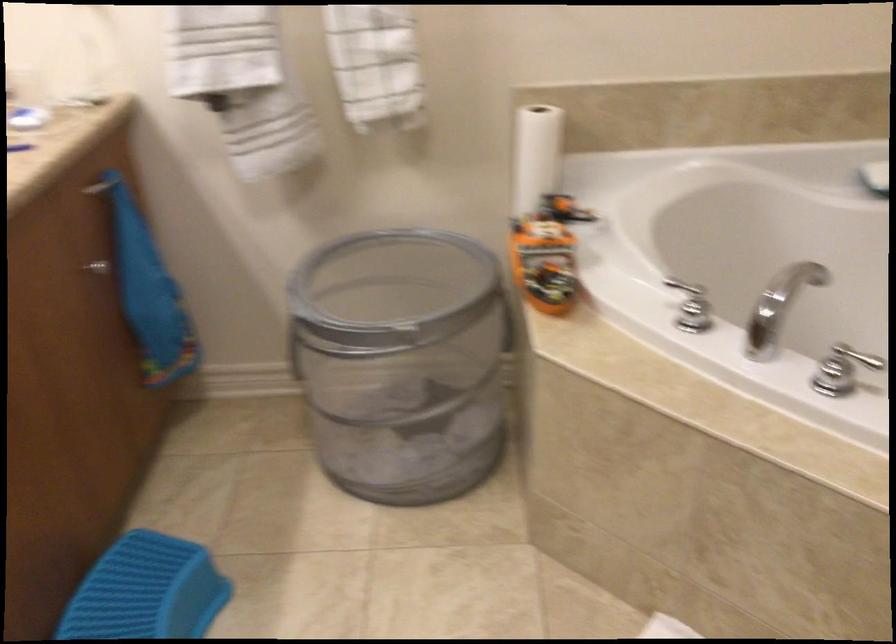
What do you see at coordinates (147, 591) in the screenshot?
I see `the blue plastic stool` at bounding box center [147, 591].